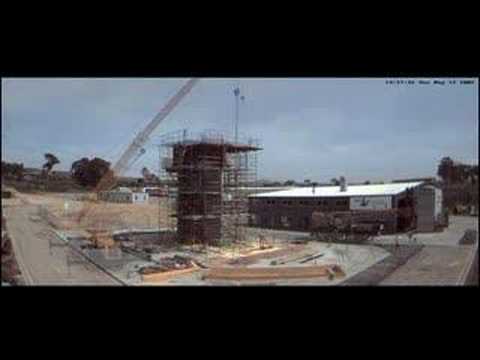
Identify the location of banner on the wall. (374, 201).